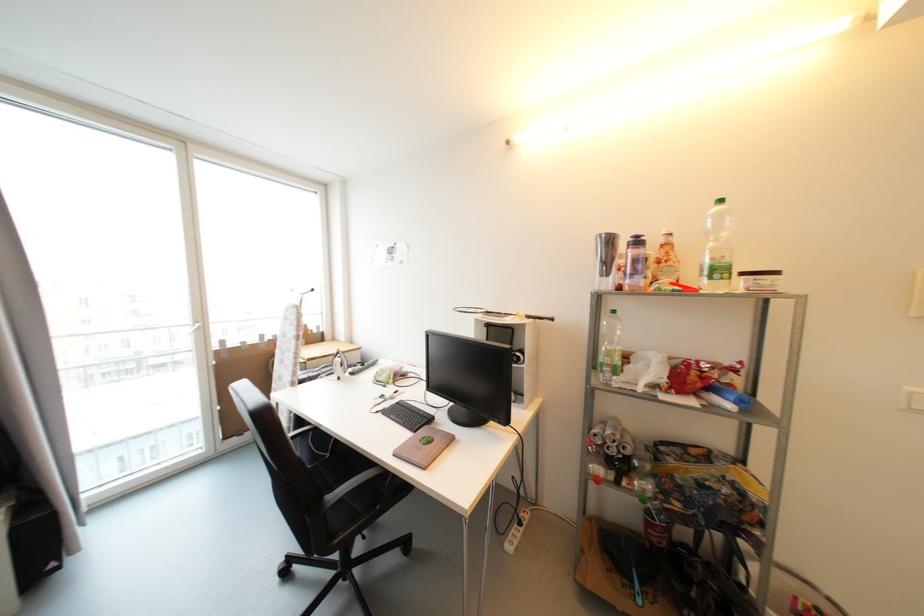
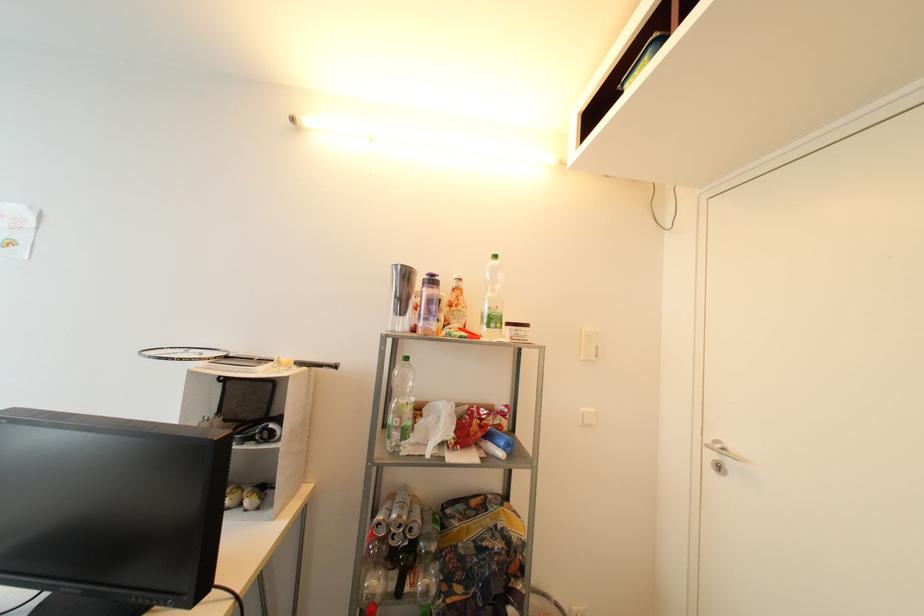
Where in the second image is the point corresponding to point 642,244 from the first image?

(438, 283)